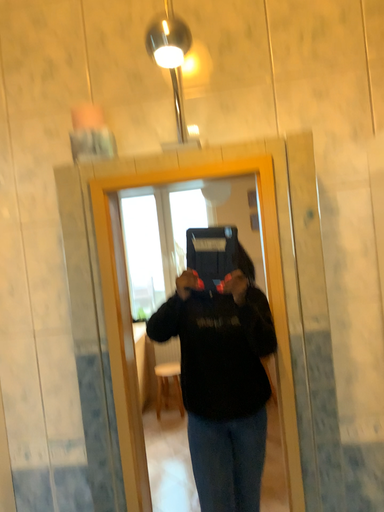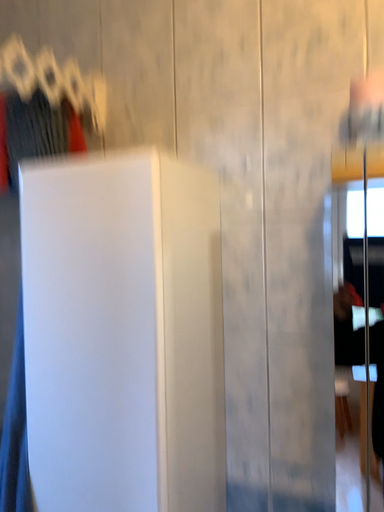
Question: How did the camera likely rotate when shooting the video?

Choices:
 (A) rotated right
 (B) rotated left

Answer: (B)